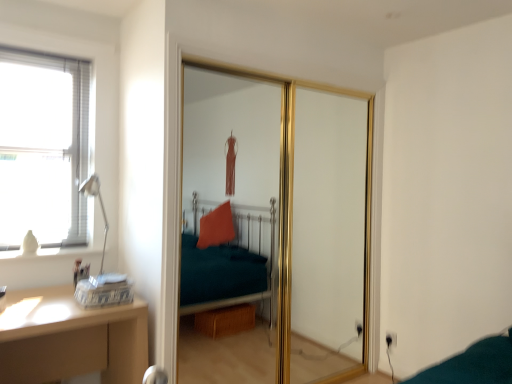
Image resolution: width=512 pixels, height=384 pixels. Identify the location of matte silver table lamp at left. (100, 205).

At what (x,y) coordinates should I click in order to perform the action: click on wooden desk at lower left. Please return your answer as a coordinate pair (x, y). Looking at the image, I should click on (70, 338).

Describe the element at coordinates (70, 338) in the screenshot. The width and height of the screenshot is (512, 384). I see `wooden desk at lower left` at that location.

Where is `matte silver table lamp at left`? This screenshot has height=384, width=512. matte silver table lamp at left is located at coordinates (100, 205).

Considering the sizes of objects matte silver table lamp at left and wooden desk at lower left in the image provided, who is bigger, matte silver table lamp at left or wooden desk at lower left?

Bigger between the two is wooden desk at lower left.

Does point (89, 181) appear closer or farther from the camera than point (90, 363)?

Point (89, 181) is farther from the camera than point (90, 363).

How far apart are matte silver table lamp at left and wooden desk at lower left?

matte silver table lamp at left is 54.10 centimeters from wooden desk at lower left.

Is matte silver table lamp at left wider or thinner than wooden desk at lower left?

matte silver table lamp at left is thinner than wooden desk at lower left.

Is wooden desk at lower left completely or partially outside of gold metallic sliding door at center?

Yes.

Is wooden desk at lower left looking in the opposite direction of gold metallic sliding door at center?

No, wooden desk at lower left is not facing away from gold metallic sliding door at center.

Considering the relative positions of wooden desk at lower left and gold metallic sliding door at center in the image provided, is wooden desk at lower left to the right of gold metallic sliding door at center from the viewer's perspective?

Incorrect, wooden desk at lower left is not on the right side of gold metallic sliding door at center.

From the image's perspective, which is above, wooden desk at lower left or gold metallic sliding door at center?

gold metallic sliding door at center appears higher in the image.

Is wooden desk at lower left situated inside matte silver table lamp at left or outside?

wooden desk at lower left cannot be found inside matte silver table lamp at left.

Is the depth of wooden desk at lower left greater than that of matte silver table lamp at left?

No, the depth of wooden desk at lower left is less than that of matte silver table lamp at left.

Considering the relative sizes of wooden desk at lower left and matte silver table lamp at left in the image provided, is wooden desk at lower left smaller than matte silver table lamp at left?

Result: No.

From the picture: Which object is further away from the camera taking this photo, gold metallic sliding door at center or wooden desk at lower left?

Positioned behind is gold metallic sliding door at center.

Between gold metallic sliding door at center and wooden desk at lower left, which one has smaller width?

Thinner between the two is gold metallic sliding door at center.

Does gold metallic sliding door at center touch wooden desk at lower left?

gold metallic sliding door at center and wooden desk at lower left are not in contact.

From the image's perspective, who appears lower, gold metallic sliding door at center or wooden desk at lower left?

wooden desk at lower left appears lower in the image.

Is matte silver table lamp at left positioned in front of gold metallic sliding door at center?

No, matte silver table lamp at left is further to the viewer.

From a real-world perspective, is matte silver table lamp at left on gold metallic sliding door at center?

Yes, from a real-world perspective, matte silver table lamp at left is on top of gold metallic sliding door at center.

Does matte silver table lamp at left have a lesser height compared to gold metallic sliding door at center?

Yes, matte silver table lamp at left is shorter than gold metallic sliding door at center.

Which object is wider, matte silver table lamp at left or gold metallic sliding door at center?

gold metallic sliding door at center is wider.

Are gold metallic sliding door at center and matte silver table lamp at left far apart?

gold metallic sliding door at center is far away from matte silver table lamp at left.

Which object is wider, gold metallic sliding door at center or matte silver table lamp at left?

With larger width is gold metallic sliding door at center.

Which object is further away from the camera taking this photo, gold metallic sliding door at center or matte silver table lamp at left?

matte silver table lamp at left is behind.

Where is `table below the matte silver table lamp at left (from the image's perspective)`? The width and height of the screenshot is (512, 384). table below the matte silver table lamp at left (from the image's perspective) is located at coordinates (70, 338).

What are the coordinates of `table to the left of gold metallic sliding door at center` in the screenshot? It's located at (70, 338).

Looking at the image, which one is located further to gold metallic sliding door at center, matte silver table lamp at left or wooden desk at lower left?

Based on the image, matte silver table lamp at left appears to be further to gold metallic sliding door at center.

When comparing their distances from matte silver table lamp at left, does gold metallic sliding door at center or wooden desk at lower left seem further?

The object further to matte silver table lamp at left is gold metallic sliding door at center.

Looking at this image, considering their positions, is gold metallic sliding door at center positioned closer to wooden desk at lower left than matte silver table lamp at left?

matte silver table lamp at left lies closer to wooden desk at lower left than the other object.

Which object lies nearer to the anchor point wooden desk at lower left, matte silver table lamp at left or gold metallic sliding door at center?

Among the two, matte silver table lamp at left is located nearer to wooden desk at lower left.

Estimate the real-world distances between objects in this image. Which object is closer to gold metallic sliding door at center, wooden desk at lower left or matte silver table lamp at left?

wooden desk at lower left is closer to gold metallic sliding door at center.

Based on their spatial positions, is wooden desk at lower left or gold metallic sliding door at center closer to matte silver table lamp at left?

Among the two, wooden desk at lower left is located nearer to matte silver table lamp at left.

Identify the location of table lamp located between wooden desk at lower left and gold metallic sliding door at center in the left-right direction. (100, 205).